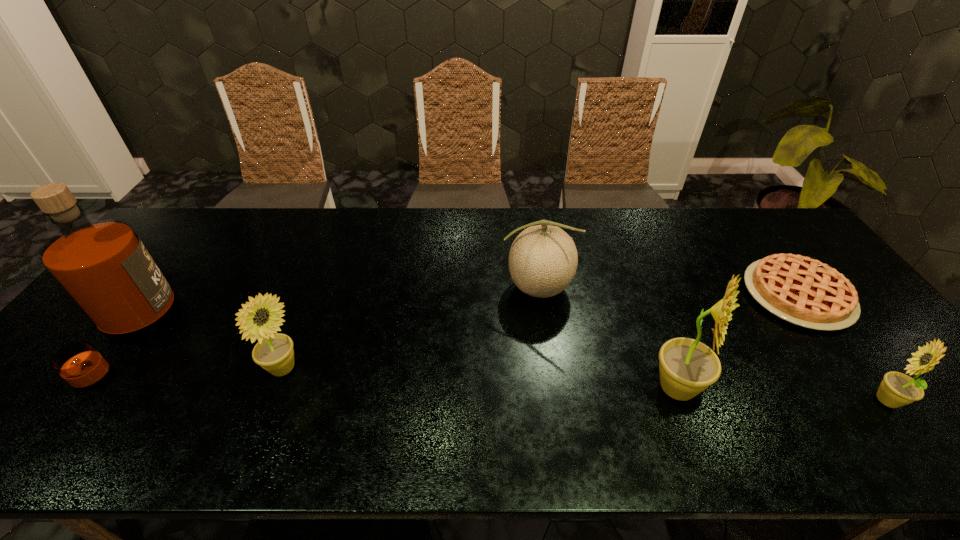
To make them evenly spaced by inserting another sunflower among them, please locate a free space for this new sunflower. Please provide its 2D coordinates. Your answer should be formatted as a tuple, i.e. [(x, y)], where the tuple contains the x and y coordinates of a point satisfying the conditions above.

[(476, 379)]